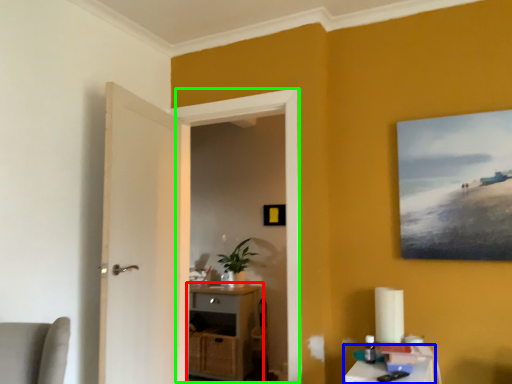
Question: Considering the real-world distances, which object is closest to cabinetry (highlighted by a red box)? table (highlighted by a blue box) or window (highlighted by a green box).

Choices:
 (A) table
 (B) window

Answer: (B)